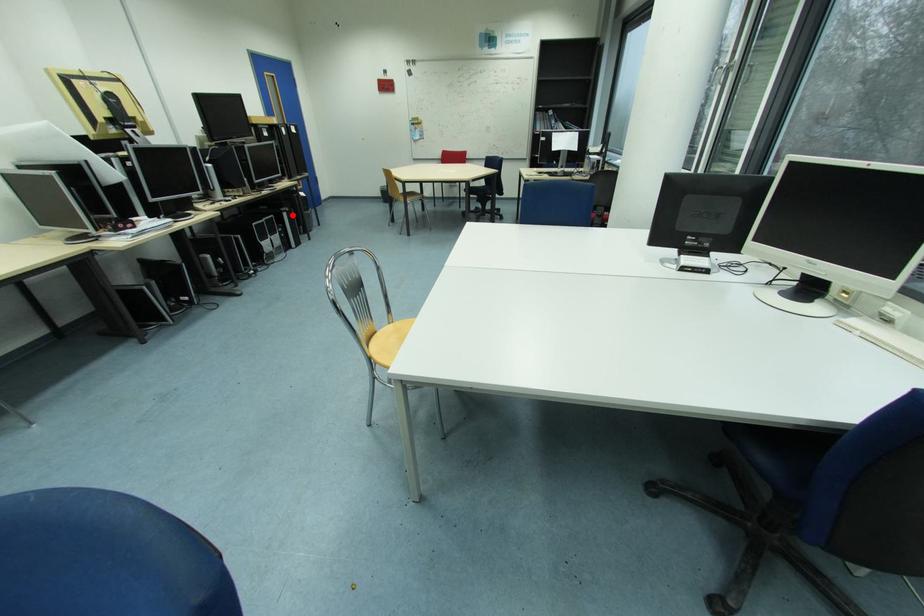
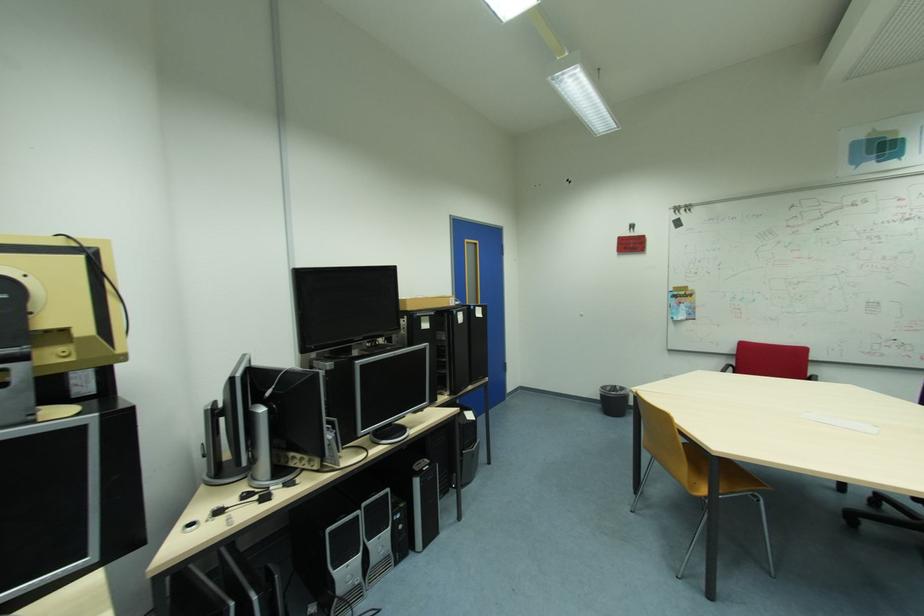
The point at the highlighted location is marked in the first image. Where is the corresponding point in the second image?

(424, 482)